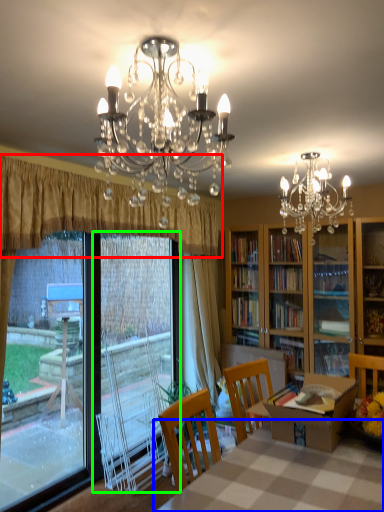
Question: Which object is positioned farthest from curtain (highlighted by a red box)? Select from table (highlighted by a blue box) and screen door (highlighted by a green box).

Choices:
 (A) table
 (B) screen door

Answer: (A)